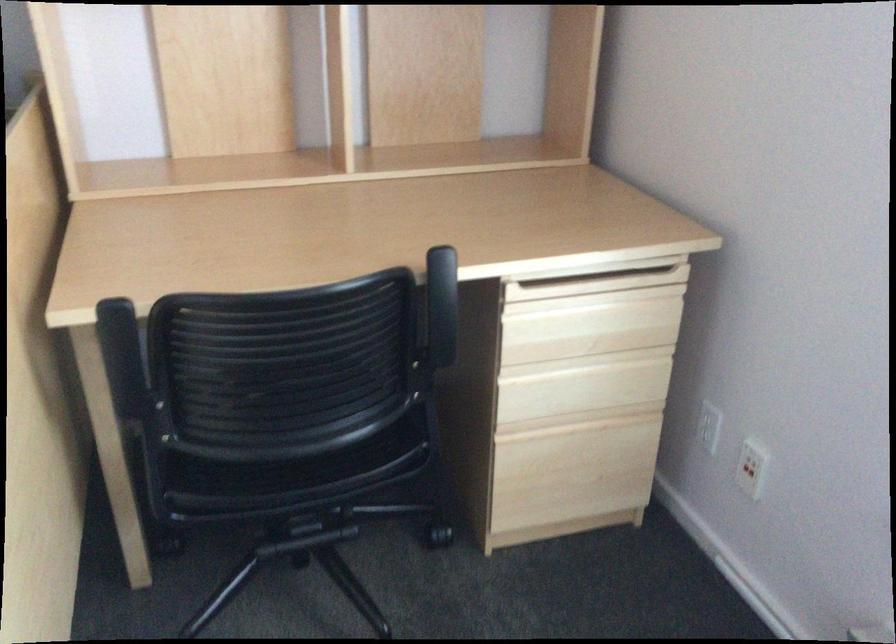
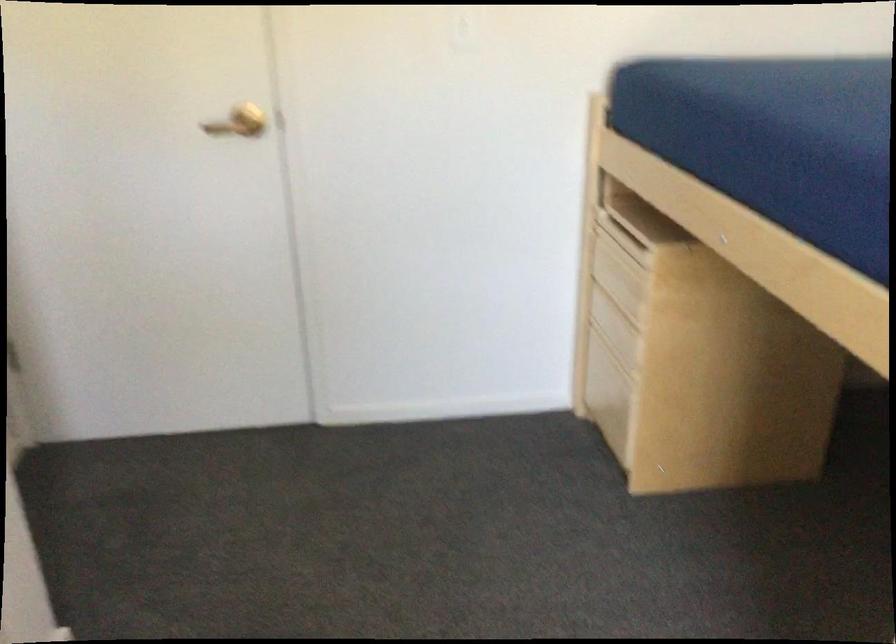
First-person continuous shooting, in which direction is the camera rotating?

The camera rotated toward left-down.